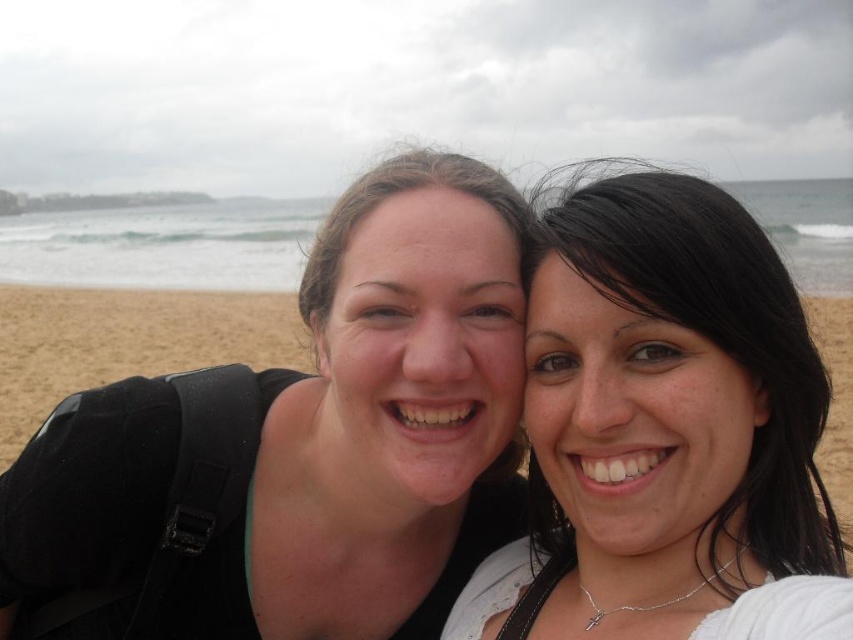
Does matte black backpack at left have a larger size compared to smooth white blouse at center?

Actually, matte black backpack at left might be smaller than smooth white blouse at center.

Can you confirm if matte black backpack at left is smaller than smooth white blouse at center?

Correct, matte black backpack at left occupies less space than smooth white blouse at center.

Who is more distant from viewer, (419, 554) or (724, 419)?

Positioned behind is point (419, 554).

Where is `matte black backpack at left`? This screenshot has width=853, height=640. matte black backpack at left is located at coordinates (299, 445).